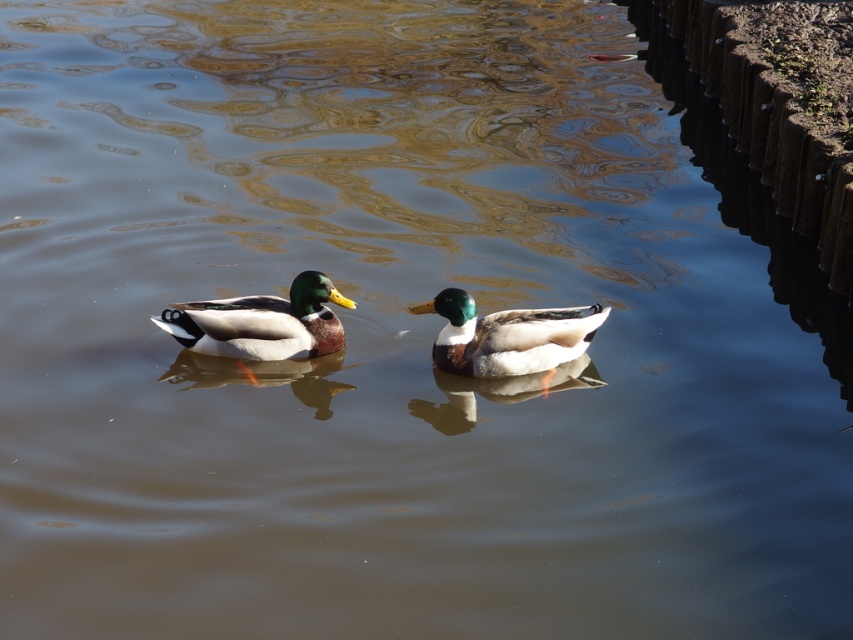
Question: Is shiny green duck at center wider than shiny brown duck at center?

Choices:
 (A) no
 (B) yes

Answer: (B)

Question: Can you confirm if shiny green duck at center is positioned below shiny brown duck at center?

Choices:
 (A) yes
 (B) no

Answer: (B)

Question: Which of the following is the farthest from the observer?

Choices:
 (A) (556, 364)
 (B) (247, 340)

Answer: (A)

Question: Can you confirm if shiny green duck at center is positioned below shiny brown duck at center?

Choices:
 (A) yes
 (B) no

Answer: (B)